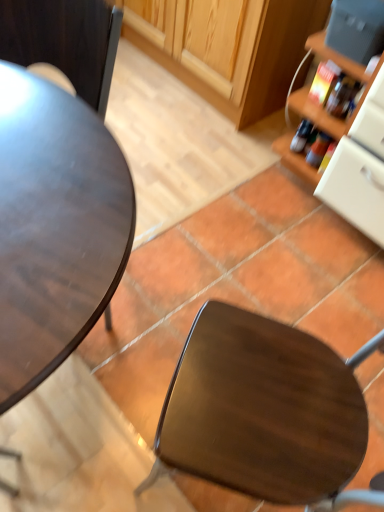
Question: Considering the relative sizes of matte gray toaster at upper right and wooden cabinet at upper center in the image provided, is matte gray toaster at upper right taller than wooden cabinet at upper center?

Choices:
 (A) yes
 (B) no

Answer: (B)

Question: Can you confirm if matte gray toaster at upper right is smaller than wooden cabinet at upper center?

Choices:
 (A) yes
 (B) no

Answer: (A)

Question: Is matte gray toaster at upper right closer to the viewer compared to wooden cabinet at upper center?

Choices:
 (A) no
 (B) yes

Answer: (B)

Question: Considering the relative sizes of matte gray toaster at upper right and wooden cabinet at upper center in the image provided, is matte gray toaster at upper right shorter than wooden cabinet at upper center?

Choices:
 (A) yes
 (B) no

Answer: (A)

Question: From a real-world perspective, is matte gray toaster at upper right on wooden cabinet at upper center?

Choices:
 (A) yes
 (B) no

Answer: (A)

Question: Does matte gray toaster at upper right lie behind wooden cabinet at upper center?

Choices:
 (A) yes
 (B) no

Answer: (B)

Question: Is translucent plastic bottle at right smaller than shiny brown chair at center?

Choices:
 (A) no
 (B) yes

Answer: (B)

Question: Considering the relative sizes of translucent plastic bottle at right and shiny brown chair at center in the image provided, is translucent plastic bottle at right bigger than shiny brown chair at center?

Choices:
 (A) yes
 (B) no

Answer: (B)

Question: From a real-world perspective, is translucent plastic bottle at right physically above shiny brown chair at center?

Choices:
 (A) yes
 (B) no

Answer: (B)

Question: Is translucent plastic bottle at right oriented towards shiny brown chair at center?

Choices:
 (A) yes
 (B) no

Answer: (B)

Question: Is shiny brown chair at center at the back of translucent plastic bottle at right?

Choices:
 (A) no
 (B) yes

Answer: (A)

Question: Are translucent plastic bottle at right and shiny brown chair at center far apart?

Choices:
 (A) yes
 (B) no

Answer: (A)

Question: Can matte dark wood desk at left be found inside shiny brown chair at center?

Choices:
 (A) no
 (B) yes

Answer: (A)